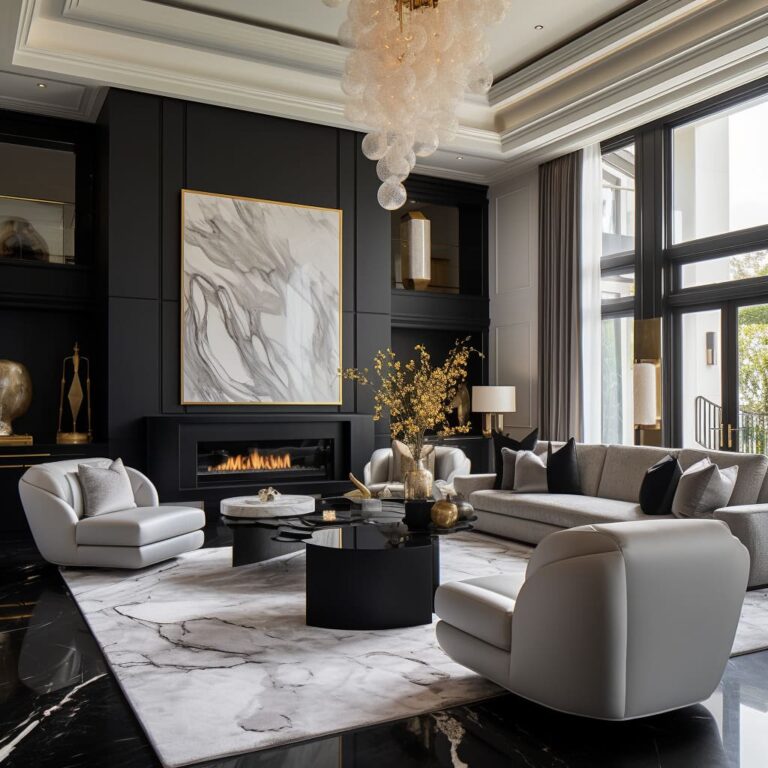
Locate an element on the screen. chairs is located at coordinates (502, 607), (151, 515).